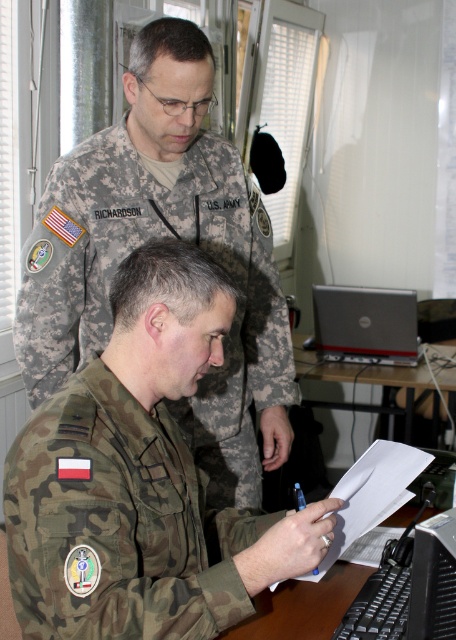
Question: Which point is closer to the camera?

Choices:
 (A) camo fabric uniform at lower left
 (B) black plastic table at center
 (C) white paper at center

Answer: (C)

Question: Among these objects, which one is nearest to the camera?

Choices:
 (A) white paper at center
 (B) black plastic keyboard at lower center
 (C) silver metallic laptop at center
 (D) black plastic table at center

Answer: (B)

Question: Is silver metallic laptop at center above white paper at center?

Choices:
 (A) yes
 (B) no

Answer: (A)

Question: Can you confirm if camo fabric uniform at lower left is wider than silver metallic laptop at center?

Choices:
 (A) yes
 (B) no

Answer: (A)

Question: Does black plastic keyboard at lower center appear on the left side of silver metallic laptop at center?

Choices:
 (A) yes
 (B) no

Answer: (A)

Question: Which object is the closest to the camo fabric uniform at lower left?

Choices:
 (A) black plastic table at center
 (B) black plastic keyboard at lower center

Answer: (B)